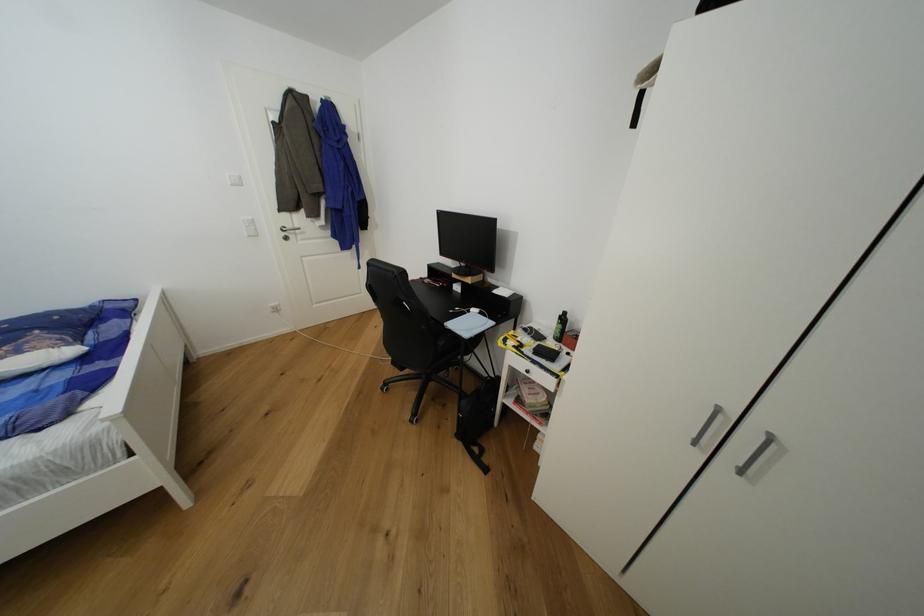
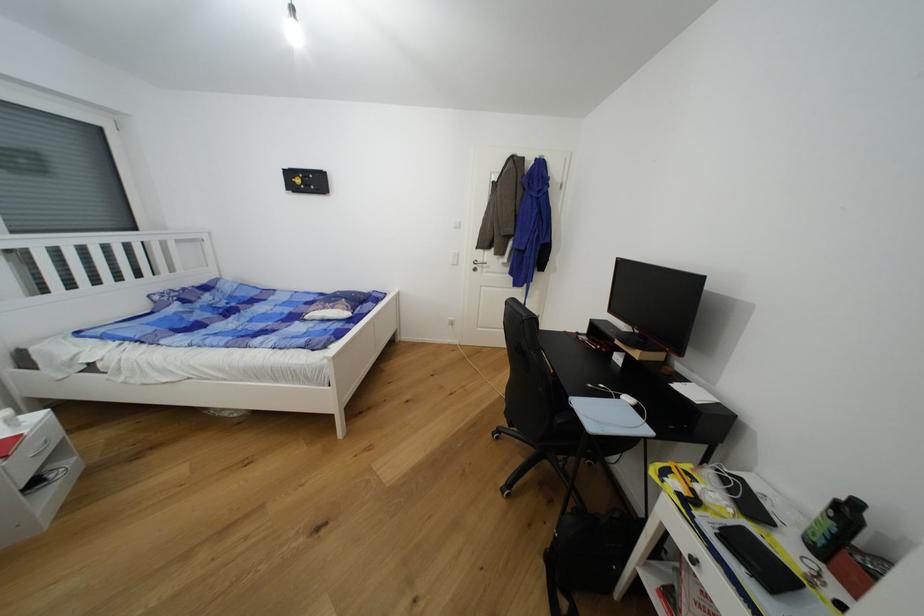
In the second image, find the point that corresponds to (570,315) in the first image.

(862, 506)